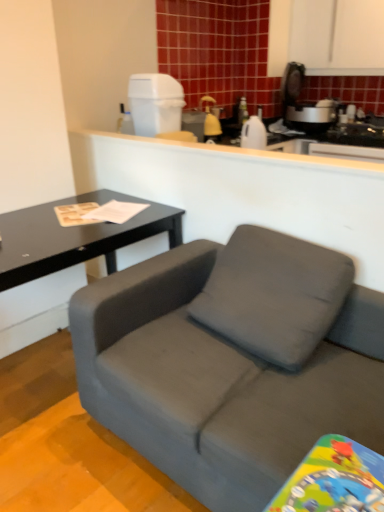
The height and width of the screenshot is (512, 384). Find the location of `black matte table at left`. black matte table at left is located at coordinates (74, 237).

Describe the element at coordinates (74, 237) in the screenshot. Image resolution: width=384 pixels, height=512 pixels. I see `black matte table at left` at that location.

What do you see at coordinates (232, 361) in the screenshot? This screenshot has width=384, height=512. I see `matte gray couch at center` at bounding box center [232, 361].

This screenshot has height=512, width=384. Find the location of `matte gray couch at center`. matte gray couch at center is located at coordinates pyautogui.click(x=232, y=361).

Identify the location of matte yellow spray bottle at upper center, acting as the 1th appliance starting from the back. This screenshot has width=384, height=512. (211, 120).

The height and width of the screenshot is (512, 384). What do you see at coordinates (345, 160) in the screenshot? I see `white matte counter at upper center` at bounding box center [345, 160].

What is the approximate height of white matte counter at upper center?

3.54 inches.

Image resolution: width=384 pixels, height=512 pixels. Find the location of `black matte table at left`. black matte table at left is located at coordinates (74, 237).

Considering the relative positions of matte gray couch at center and matte yellow spray bottle at upper center, which appears as the 2th appliance when viewed from the left, in the image provided, is matte gray couch at center to the left or to the right of matte yellow spray bottle at upper center, which appears as the 2th appliance when viewed from the left,?

Based on their positions, matte gray couch at center is located to the right of matte yellow spray bottle at upper center, which appears as the 2th appliance when viewed from the left.

Is matte gray couch at center positioned behind matte yellow spray bottle at upper center, acting as the 1th appliance starting from the back?

No, the depth of matte gray couch at center is less than that of matte yellow spray bottle at upper center, acting as the 1th appliance starting from the back.

Can you confirm if matte gray couch at center is thinner than matte yellow spray bottle at upper center, the 2th appliance from the front?

In fact, matte gray couch at center might be wider than matte yellow spray bottle at upper center, the 2th appliance from the front.

From the image's perspective, does matte gray couch at center appear lower than matte yellow spray bottle at upper center, the 2th appliance from the front?

Yes, from the image's perspective, matte gray couch at center is below matte yellow spray bottle at upper center, the 2th appliance from the front.

In terms of height, does white matte counter at upper center look taller or shorter compared to matte gray couch at center?

A: Considering their sizes, white matte counter at upper center has less height than matte gray couch at center.

How many degrees apart are the facing directions of white matte counter at upper center and matte gray couch at center?

There is a 0.00168-degree angle between the facing directions of white matte counter at upper center and matte gray couch at center.

Which is in front, white matte counter at upper center or matte gray couch at center?

matte gray couch at center.

Between point (156, 92) and point (370, 157), which one is positioned behind?

Positioned behind is point (370, 157).

Between white plastic trash can at upper center, which is counted as the 1th appliance, starting from the front, and white matte counter at upper center, which one has more height?

Standing taller between the two is white plastic trash can at upper center, which is counted as the 1th appliance, starting from the front.

Is white plastic trash can at upper center, placed as the second appliance when sorted from back to front, in front of or behind white matte counter at upper center in the image?

white plastic trash can at upper center, placed as the second appliance when sorted from back to front, is positioned farther from the viewer than white matte counter at upper center.

Between white plastic trash can at upper center, which is counted as the 1th appliance, starting from the front, and white matte counter at upper center, which one has smaller width?

Thinner between the two is white matte counter at upper center.

Would you say black matte table at left is inside or outside matte yellow spray bottle at upper center, the first appliance from the right?

black matte table at left cannot be found inside matte yellow spray bottle at upper center, the first appliance from the right.

Based on their positions, is black matte table at left located to the left or right of matte yellow spray bottle at upper center, acting as the 1th appliance starting from the back?

In the image, black matte table at left appears on the left side of matte yellow spray bottle at upper center, acting as the 1th appliance starting from the back.

Would you say black matte table at left is a long distance from matte yellow spray bottle at upper center, the first appliance from the right?

That's right, there is a large distance between black matte table at left and matte yellow spray bottle at upper center, the first appliance from the right.

Considering their positions, is black matte table at left located in front of or behind matte yellow spray bottle at upper center, the 2th appliance from the front?

black matte table at left is positioned closer to the viewer than matte yellow spray bottle at upper center, the 2th appliance from the front.

Does matte yellow spray bottle at upper center, acting as the 1th appliance starting from the back, lie behind white matte counter at upper center?

Yes, it is.

Can you confirm if matte yellow spray bottle at upper center, acting as the 1th appliance starting from the back, is shorter than white matte counter at upper center?

No, matte yellow spray bottle at upper center, acting as the 1th appliance starting from the back, is not shorter than white matte counter at upper center.

How many degrees apart are the facing directions of matte yellow spray bottle at upper center, which appears as the 2th appliance when viewed from the left, and white matte counter at upper center?

90 degrees separate the facing orientations of matte yellow spray bottle at upper center, which appears as the 2th appliance when viewed from the left, and white matte counter at upper center.

Is matte yellow spray bottle at upper center, the 2th appliance from the front, inside the boundaries of white matte counter at upper center, or outside?

The correct answer is: outside.

Is matte yellow spray bottle at upper center, the 2th appliance from the front, facing away from white plastic trash can at upper center, positioned as the 1th appliance in left-to-right order?

No, matte yellow spray bottle at upper center, the 2th appliance from the front, is not facing away from white plastic trash can at upper center, positioned as the 1th appliance in left-to-right order.

Based on the photo, considering the relative sizes of matte yellow spray bottle at upper center, acting as the 1th appliance starting from the back, and white plastic trash can at upper center, placed as the second appliance when sorted from back to front, in the image provided, is matte yellow spray bottle at upper center, acting as the 1th appliance starting from the back, thinner than white plastic trash can at upper center, placed as the second appliance when sorted from back to front,?

Yes.

Considering the relative positions of matte yellow spray bottle at upper center, the first appliance from the right, and white plastic trash can at upper center, placed as the second appliance when sorted from back to front, in the image provided, is matte yellow spray bottle at upper center, the first appliance from the right, to the left of white plastic trash can at upper center, placed as the second appliance when sorted from back to front, from the viewer's perspective?

In fact, matte yellow spray bottle at upper center, the first appliance from the right, is to the right of white plastic trash can at upper center, placed as the second appliance when sorted from back to front.

Is point (211, 137) closer or farther from the camera than point (154, 94)?

Point (211, 137).

Between white plastic trash can at upper center, placed as the second appliance when sorted from back to front, and black matte table at left, which one has less height?

Standing shorter between the two is white plastic trash can at upper center, placed as the second appliance when sorted from back to front.

Based on the photo, from a real-world perspective, is white plastic trash can at upper center, which is counted as the second appliance, starting from the right, physically located above or below black matte table at left?

white plastic trash can at upper center, which is counted as the second appliance, starting from the right, is situated higher than black matte table at left in the real world.

Which is behind, white plastic trash can at upper center, which is counted as the second appliance, starting from the right, or black matte table at left?

white plastic trash can at upper center, which is counted as the second appliance, starting from the right, is behind.

Is point (136, 104) closer or farther from the camera than point (162, 214)?

Point (136, 104) is positioned farther from the camera compared to point (162, 214).

Where is `studio couch below the matte yellow spray bottle at upper center, the first appliance from the right (from a real-world perspective)`? studio couch below the matte yellow spray bottle at upper center, the first appliance from the right (from a real-world perspective) is located at coordinates (232, 361).

This screenshot has width=384, height=512. In order to click on counter above the matte gray couch at center (from a real-world perspective) in this screenshot , I will do `click(345, 160)`.

Based on their spatial positions, is matte yellow spray bottle at upper center, the 2th appliance from the front, or black matte table at left further from white plastic trash can at upper center, placed as the second appliance when sorted from back to front?

Among the two, black matte table at left is located further to white plastic trash can at upper center, placed as the second appliance when sorted from back to front.

Considering their positions, is black matte table at left positioned further to matte yellow spray bottle at upper center, the 2th appliance from the front, than white matte counter at upper center?

black matte table at left is positioned further to the anchor matte yellow spray bottle at upper center, the 2th appliance from the front.

Which object lies nearer to the anchor point matte yellow spray bottle at upper center, the first appliance from the right, black matte table at left or white plastic trash can at upper center, positioned as the 1th appliance in left-to-right order?

Among the two, white plastic trash can at upper center, positioned as the 1th appliance in left-to-right order, is located nearer to matte yellow spray bottle at upper center, the first appliance from the right.

Based on their spatial positions, is white plastic trash can at upper center, which is counted as the 1th appliance, starting from the front, or matte gray couch at center closer to matte yellow spray bottle at upper center, which appears as the 2th appliance when viewed from the left?

Based on the image, white plastic trash can at upper center, which is counted as the 1th appliance, starting from the front, appears to be nearer to matte yellow spray bottle at upper center, which appears as the 2th appliance when viewed from the left.

Considering their positions, is white matte counter at upper center positioned closer to matte yellow spray bottle at upper center, the first appliance from the right, than white plastic trash can at upper center, which is counted as the 1th appliance, starting from the front?

Based on the image, white plastic trash can at upper center, which is counted as the 1th appliance, starting from the front, appears to be nearer to matte yellow spray bottle at upper center, the first appliance from the right.

Based on their spatial positions, is matte yellow spray bottle at upper center, which appears as the 2th appliance when viewed from the left, or white matte counter at upper center closer to white plastic trash can at upper center, positioned as the 1th appliance in left-to-right order?

white matte counter at upper center lies closer to white plastic trash can at upper center, positioned as the 1th appliance in left-to-right order, than the other object.

Considering their positions, is black matte table at left positioned closer to white plastic trash can at upper center, which is counted as the second appliance, starting from the right, than matte gray couch at center?

black matte table at left lies closer to white plastic trash can at upper center, which is counted as the second appliance, starting from the right, than the other object.

Based on the photo, from the image, which object appears to be farther from black matte table at left, matte yellow spray bottle at upper center, which appears as the 2th appliance when viewed from the left, or white matte counter at upper center?

matte yellow spray bottle at upper center, which appears as the 2th appliance when viewed from the left, lies further to black matte table at left than the other object.

You are a GUI agent. You are given a task and a screenshot of the screen. Output one action in this format:
    pyautogui.click(x=<x>, y=<y>)
    Task: Click on the appliance between white matte counter at upper center and matte yellow spray bottle at upper center, which appears as the 2th appliance when viewed from the left, along the z-axis
    The width and height of the screenshot is (384, 512).
    Given the screenshot: What is the action you would take?
    pyautogui.click(x=155, y=103)

The image size is (384, 512). Identify the location of appliance positioned between matte gray couch at center and matte yellow spray bottle at upper center, the first appliance from the right, from near to far. (155, 103).

At what (x,y) coordinates should I click in order to perform the action: click on coffee table between white matte counter at upper center and matte gray couch at center in the up-down direction. Please return your answer as a coordinate pair (x, y). The width and height of the screenshot is (384, 512). Looking at the image, I should click on pyautogui.click(x=74, y=237).

This screenshot has width=384, height=512. I want to click on counter between white plastic trash can at upper center, which is counted as the second appliance, starting from the right, and black matte table at left, in the vertical direction, so click(x=345, y=160).